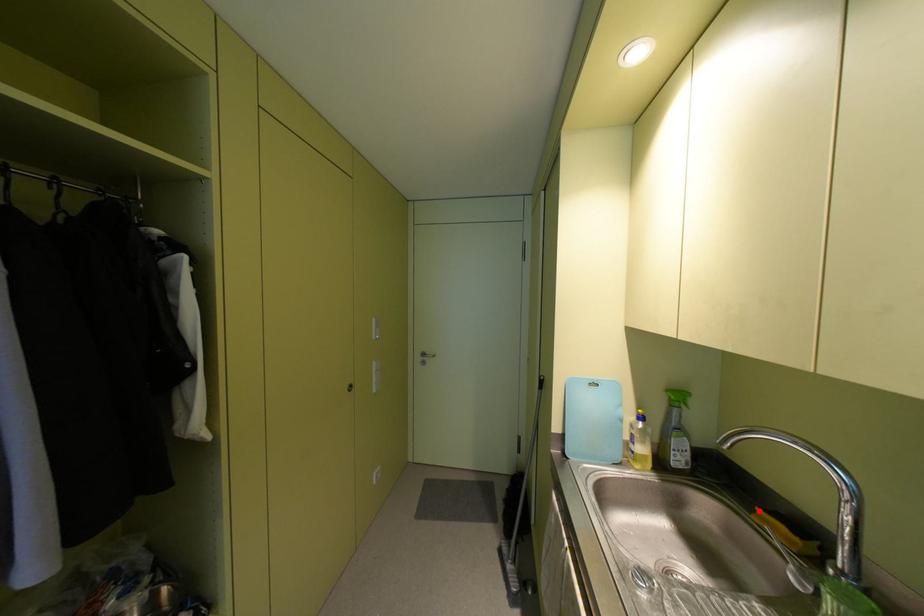
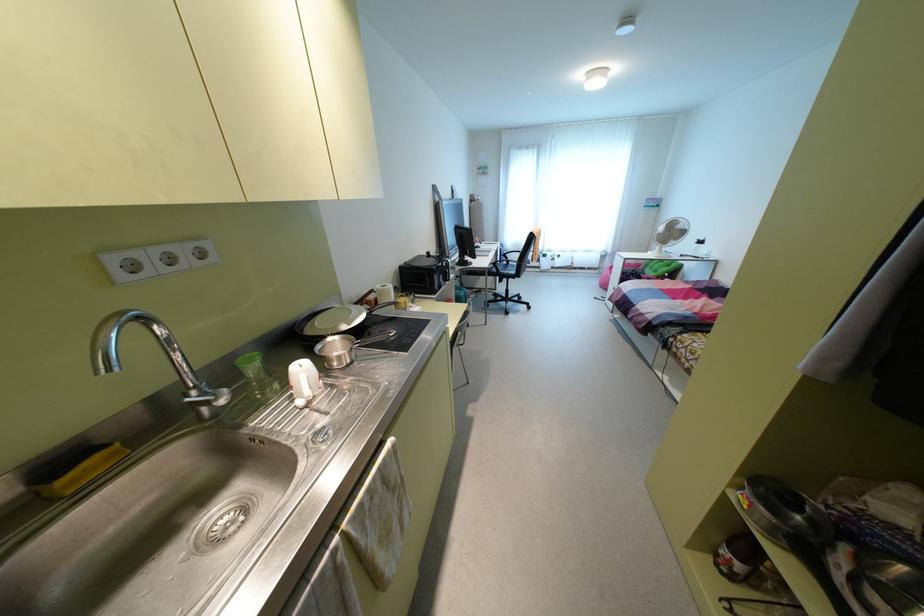
Find the pixel in the second image that matches the highlighted location in the first image.

(59, 482)